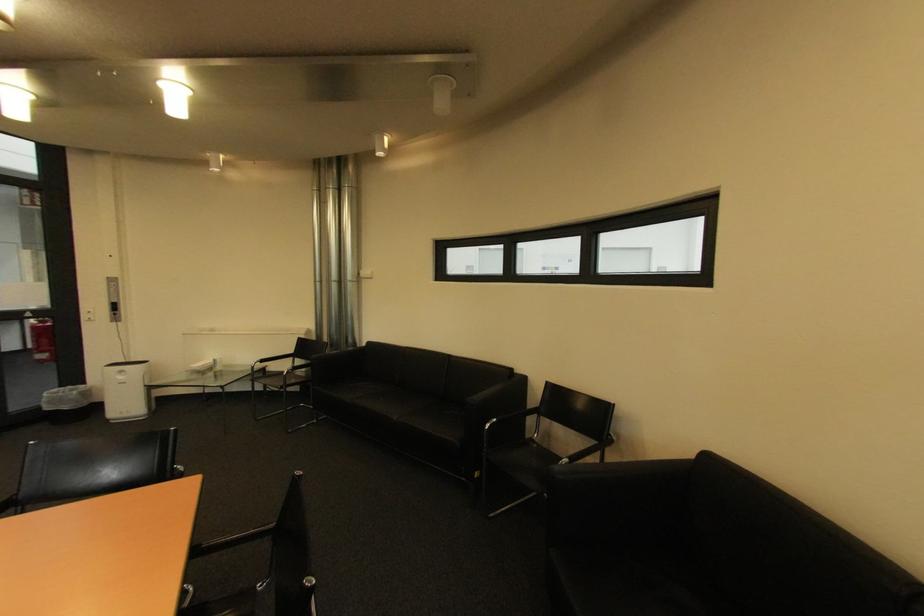
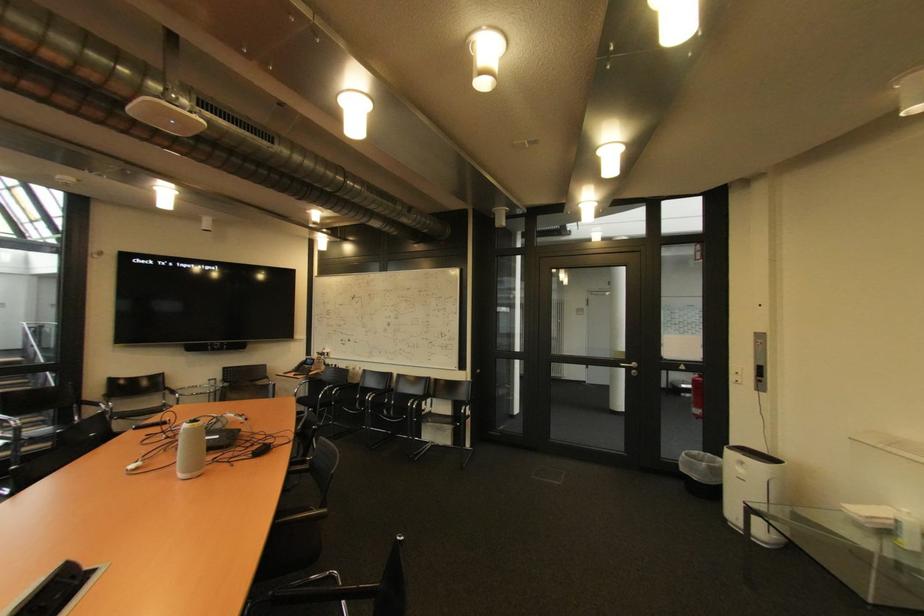
In the second image, find the point that corresponds to (x=42, y=359) in the first image.

(699, 411)